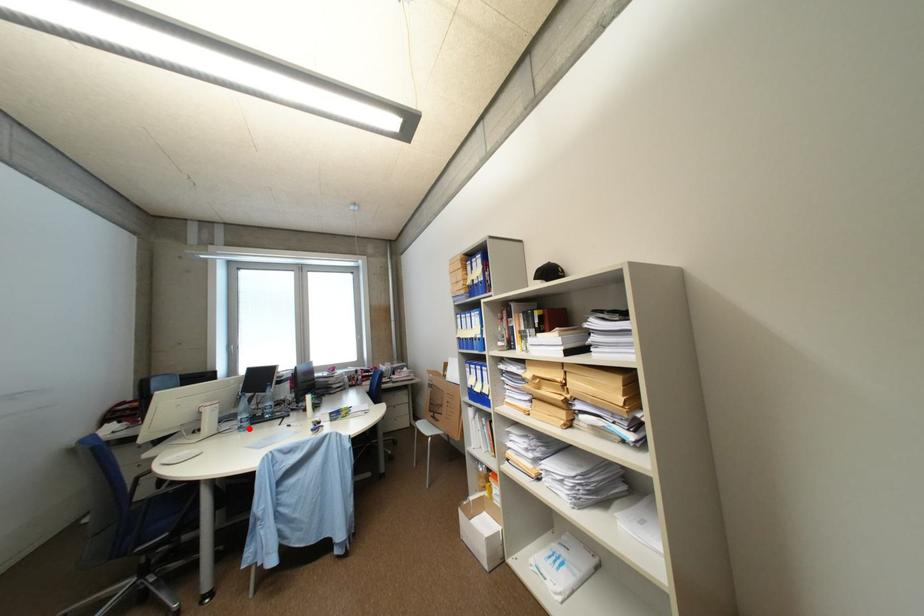
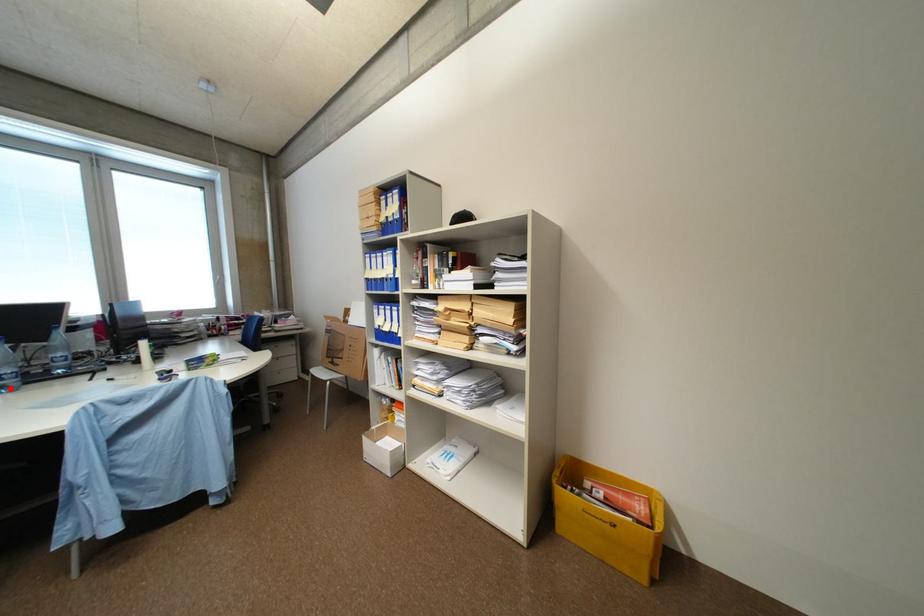
I am providing you with two images of the same scene from different viewpoints. A red point is marked on the first image and another point is marked on the second image. Does the point marked in image1 correspond to the same location as the one in image2?

Yes